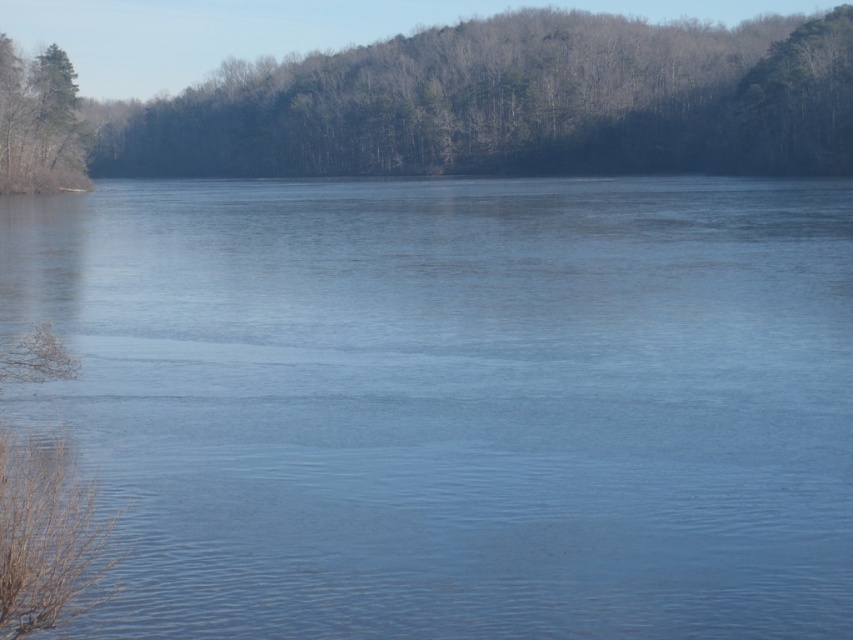
Based on the scene description, where is the blue water at center located in terms of coordinates?

The blue water at center is located at point coordinates of (453, 401).

You are standing at the edge of the lake and see the point marked as point (453,401). Is this point located in the blue water at center?

Yes, the point (453,401) is located in the blue water at center as described.

You are a bird flying over the serene lake. You want to land on the closest tree to your current position, which is between the green leafy trees at upper center and the green matte tree at upper left. Which tree should you choose?

The green matte tree at upper left is closer to your current position because it is only 144.84 feet away from the green leafy trees at upper center, so whichever tree is closer depends on your exact location between them. However, since the distance between them is fixed, you would need to know your exact position to determine the closest one.